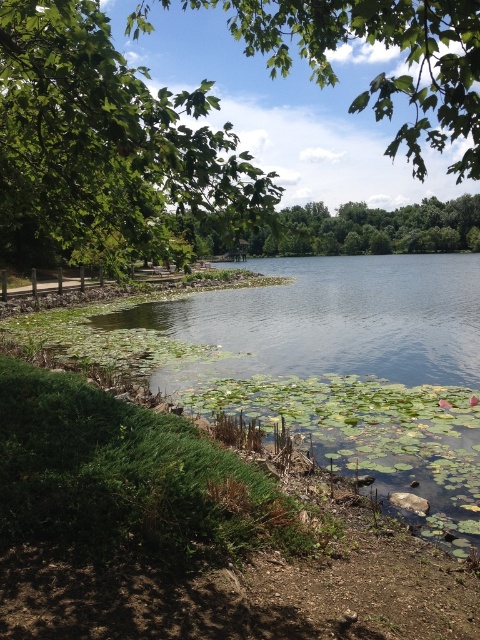
You are standing at the lakeside and want to take a photo of the green leafy tree at upper left and the green leafy tree at upper center. Which tree will appear closer to the camera in your photo?

The green leafy tree at upper left will appear closer to the camera because it is in front of the green leafy tree at upper center.

Consider the image. You are a hiker who wants to take a photo of the green leafy tree at upper center and the green leafy tree at center. Which tree should you move closer to in order to capture both trees in the frame without zooming in?

You should move closer to the green leafy tree at center because it is narrower than the green leafy tree at upper center, allowing both to fit in the frame when positioned closer to the narrower tree.

You are standing at the edge of the lake and see a point marked at coordinates (106, 148). Based on the scene description, what object is located at this point?

The point at coordinates (106, 148) corresponds to the green leafy tree at upper left.